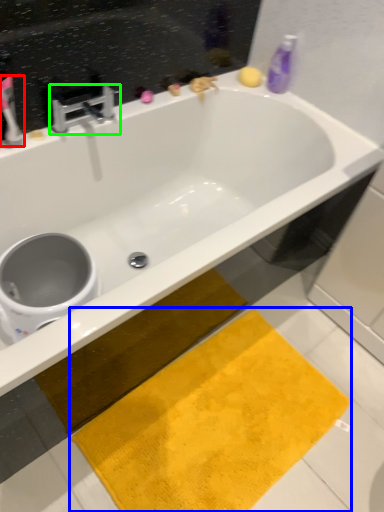
Question: Which object is the farthest from toothbrush (highlighted by a red box)? Choose among these: beach towel (highlighted by a blue box) or tap (highlighted by a green box).

Choices:
 (A) beach towel
 (B) tap

Answer: (A)